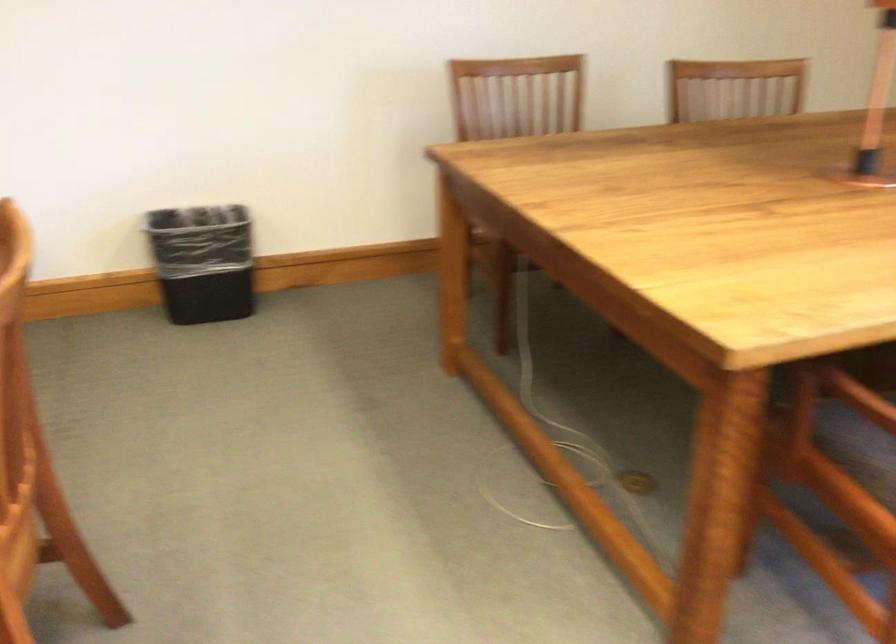
The image size is (896, 644). Describe the element at coordinates (202, 261) in the screenshot. I see `the black trash can` at that location.